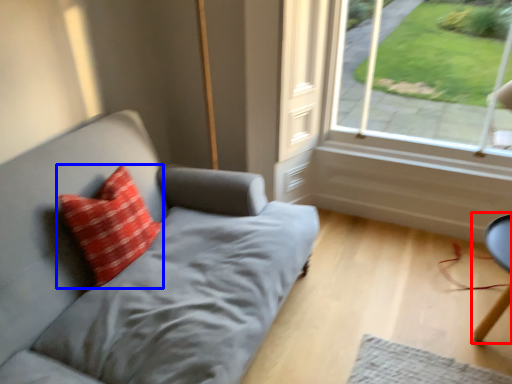
Question: Which object is further to the camera taking this photo, computer chair (highlighted by a red box) or pillow (highlighted by a blue box)?

Choices:
 (A) computer chair
 (B) pillow

Answer: (A)